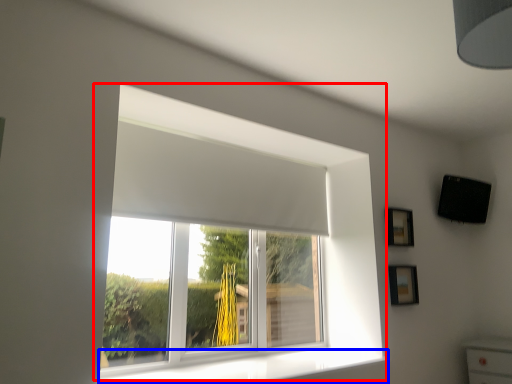
Question: Which of the following is the farthest to the observer, window (highlighted by a red box) or window sill (highlighted by a blue box)?

Choices:
 (A) window
 (B) window sill

Answer: (A)